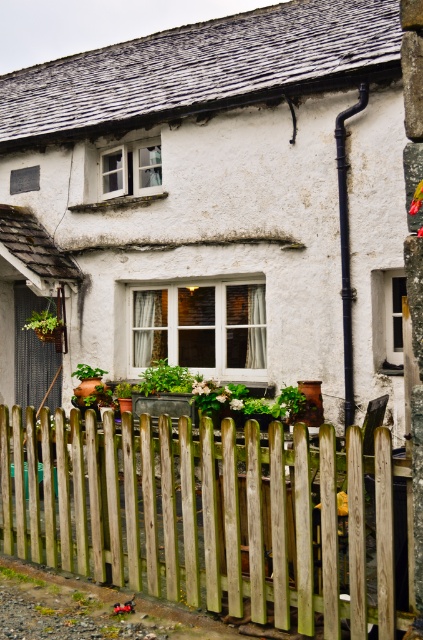
Question: Does white matte wooden fence at lower center appear under weathered wood fence at lower center?

Choices:
 (A) yes
 (B) no

Answer: (B)

Question: In this image, where is white matte wooden fence at lower center located relative to weathered wood fence at lower center?

Choices:
 (A) right
 (B) left

Answer: (B)

Question: Is white matte wooden fence at lower center positioned in front of weathered wood fence at lower center?

Choices:
 (A) no
 (B) yes

Answer: (B)

Question: Which point is farther to the camera?

Choices:
 (A) weathered wood fence at lower center
 (B) white matte wooden fence at lower center

Answer: (A)

Question: Which point is closer to the camera?

Choices:
 (A) (384, 314)
 (B) (217, 570)

Answer: (B)